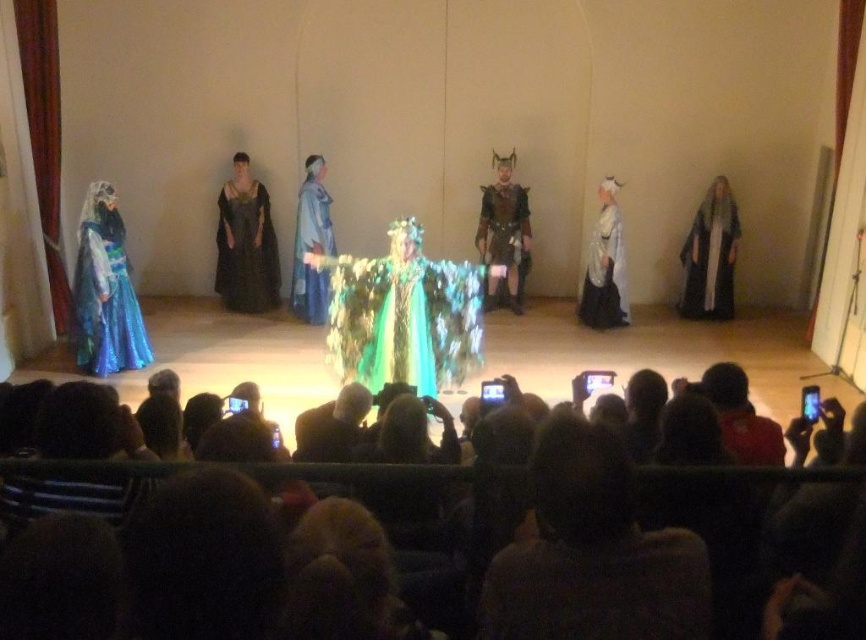
Question: Estimate the real-world distances between objects in this image. Which object is farther from the matte black dress at center?

Choices:
 (A) dark hair at center
 (B) white satin robe at right

Answer: (A)

Question: Can you confirm if white silk robe at right is positioned to the left of shiny blue fabric dress at center?

Choices:
 (A) no
 (B) yes

Answer: (A)

Question: Among these points, which one is farthest from the camera?

Choices:
 (A) (40, 490)
 (B) (729, 189)

Answer: (B)

Question: Is silky black hair at center in front of white silk robe at right?

Choices:
 (A) yes
 (B) no

Answer: (A)

Question: Which object is positioned closest to the shiny blue fabric dress at center?

Choices:
 (A) matte black dress at center
 (B) white silk robe at right
 (C) dark brown hair at lower center

Answer: (A)

Question: Can you confirm if shiny blue fabric dress at center is wider than dark hair at center?

Choices:
 (A) no
 (B) yes

Answer: (B)